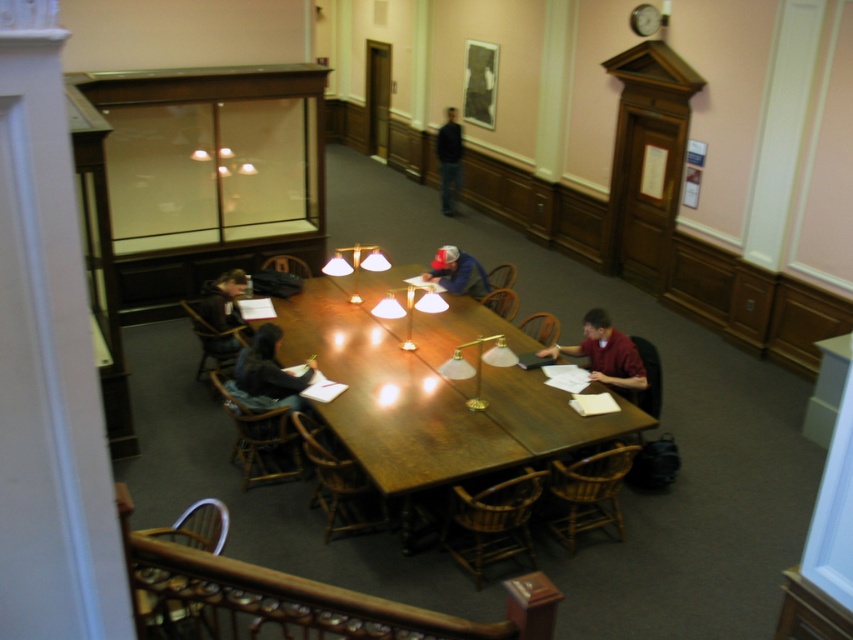
Is wooden table at center below white knit cap at center?

Correct, wooden table at center is located below white knit cap at center.

Who is positioned more to the right, wooden table at center or white knit cap at center?

From the viewer's perspective, white knit cap at center appears more on the right side.

You are a GUI agent. You are given a task and a screenshot of the screen. Output one action in this format:
    pyautogui.click(x=<x>, y=<y>)
    Task: Click on the wooden table at center
    The image size is (853, 640).
    Given the screenshot: What is the action you would take?
    pyautogui.click(x=430, y=390)

Is point (274, 358) positioned behind point (573, 346)?

That is False.

Locate an element on the screen. dark gray sweater at center is located at coordinates (268, 372).

Does white knit cap at center come in front of dark blue jeans at center?

Yes.

Can you confirm if white knit cap at center is positioned to the left of dark blue jeans at center?

In fact, white knit cap at center is to the right of dark blue jeans at center.

The width and height of the screenshot is (853, 640). What are the coordinates of `white knit cap at center` in the screenshot? It's located at click(x=457, y=273).